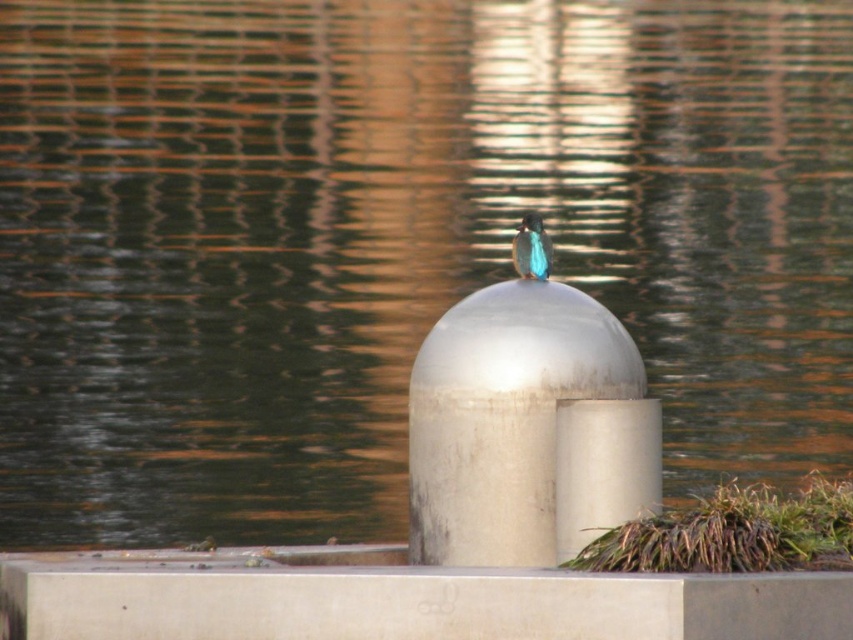
Between point (546, 513) and point (549, 259), which one is positioned in front?

Point (546, 513)

Can you confirm if satin silver dome at center is positioned to the right of blue glossy bird at center?

In fact, satin silver dome at center is to the left of blue glossy bird at center.

This screenshot has width=853, height=640. In order to click on satin silver dome at center in this screenshot , I will do `click(503, 417)`.

Locate an element on the screen. The height and width of the screenshot is (640, 853). satin silver dome at center is located at coordinates (503, 417).